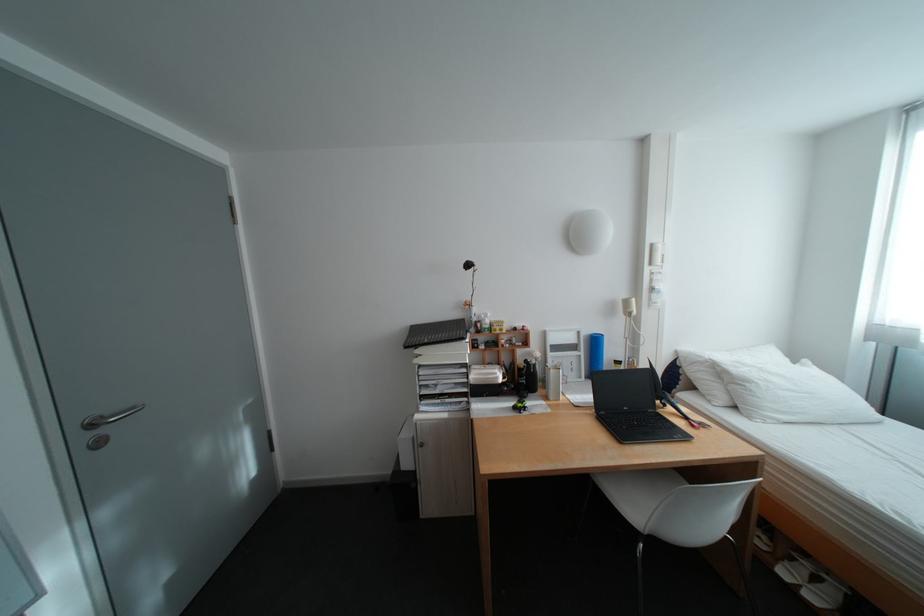
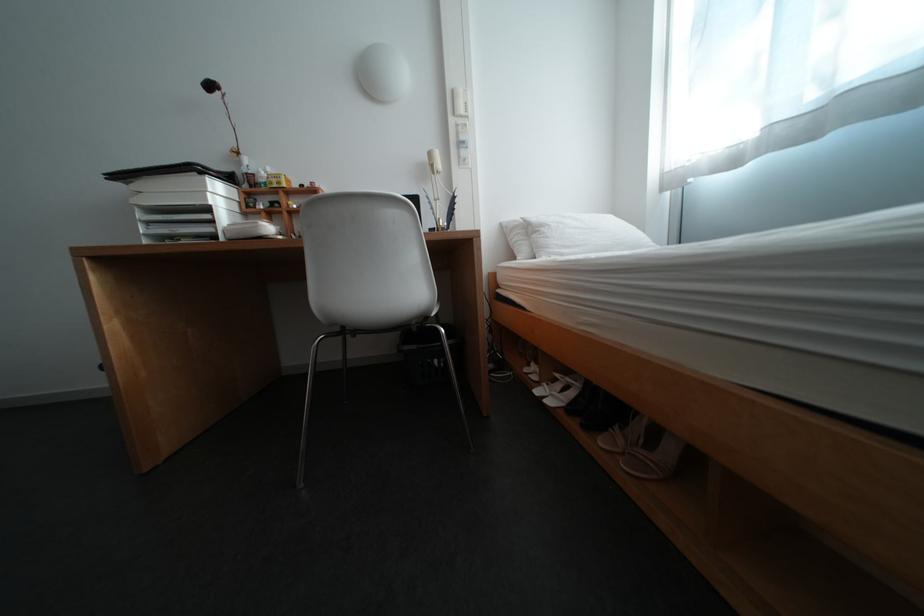
Locate, in the second image, the point that corresponds to point 806,560 in the first image.

(568, 381)